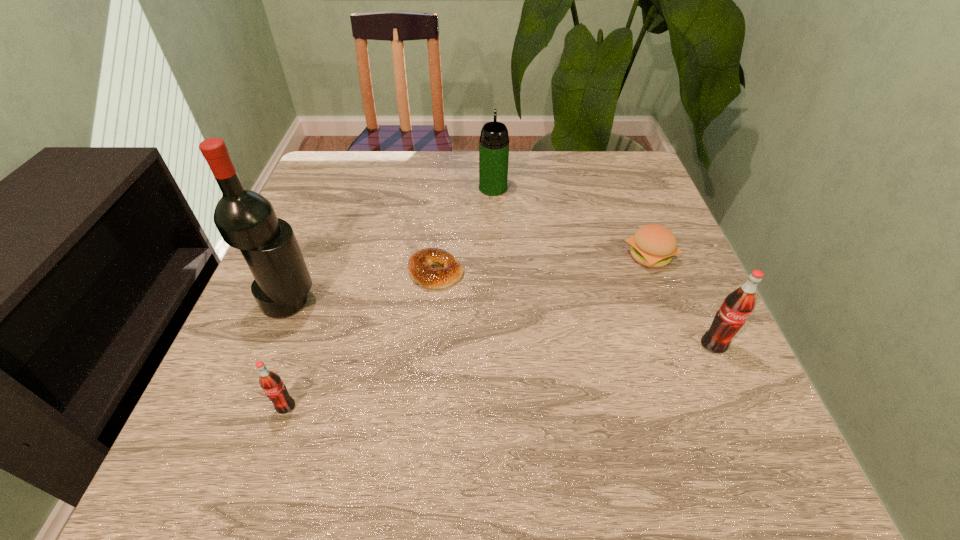
To ensure equal spacing by inserting another pop_(soda) among them, please point out a vacant spot for this new pop_(soda). Please provide its 2D coordinates. Your answer should be formatted as a tuple, i.e. [(x, y)], where the tuple contains the x and y coordinates of a point satisfying the conditions above.

[(512, 374)]